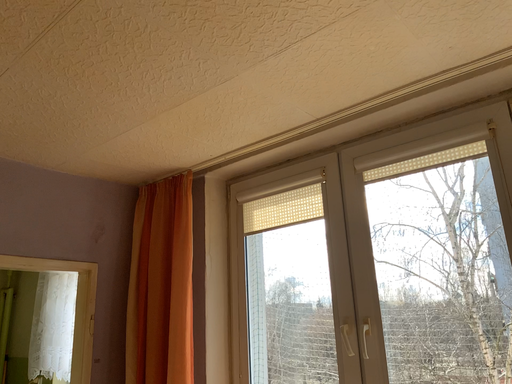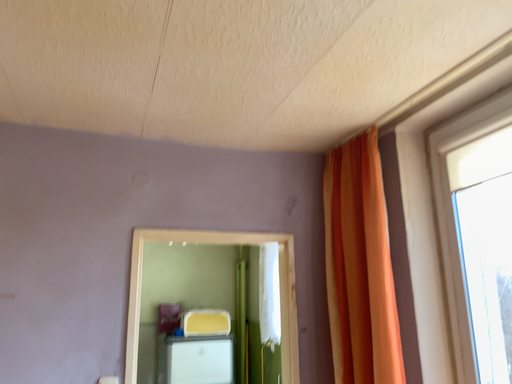
Question: Which way did the camera rotate in the video?

Choices:
 (A) rotated right
 (B) rotated left

Answer: (B)